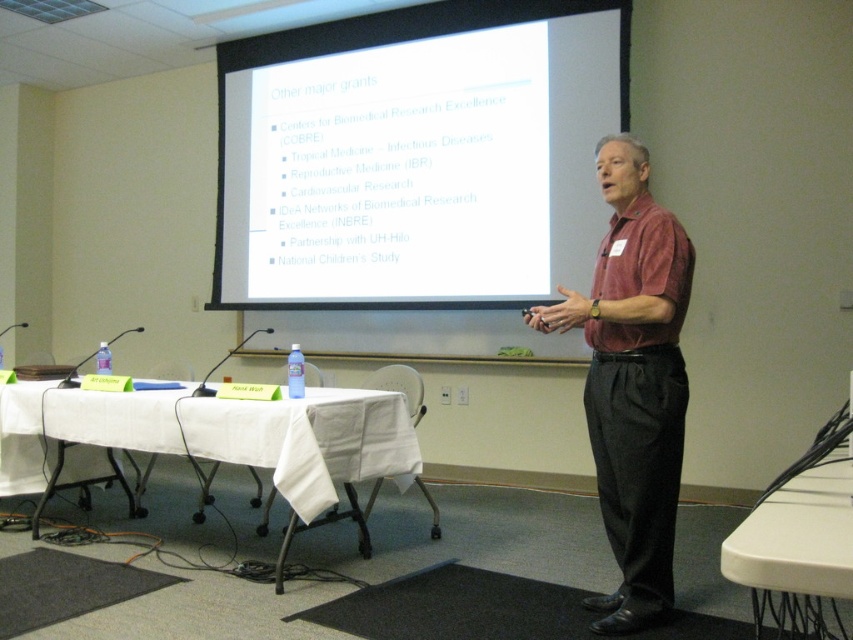
Who is more forward, (372, 184) or (265, 454)?

Point (265, 454)

Who is more distant from viewer, (598, 61) or (378, 456)?

The point (598, 61) is behind.

This screenshot has height=640, width=853. In order to click on white matte projector screen at upper center in this screenshot , I will do [x=415, y=154].

Where is `white matte projector screen at upper center`? This screenshot has height=640, width=853. white matte projector screen at upper center is located at coordinates (415, 154).

Measure the distance between matte red shirt at center and white cloth table at lower left.

matte red shirt at center is 1.35 meters away from white cloth table at lower left.

At what (x,y) coordinates should I click in order to perform the action: click on matte red shirt at center. Please return your answer as a coordinate pair (x, y). The image size is (853, 640). Looking at the image, I should click on (631, 381).

Is point (49, 426) positioned behind point (750, 509)?

No, it is in front of (750, 509).

Describe the element at coordinates (219, 435) in the screenshot. Image resolution: width=853 pixels, height=640 pixels. I see `white cloth table at lower left` at that location.

Find the location of a particular element. The height and width of the screenshot is (640, 853). white cloth table at lower left is located at coordinates (219, 435).